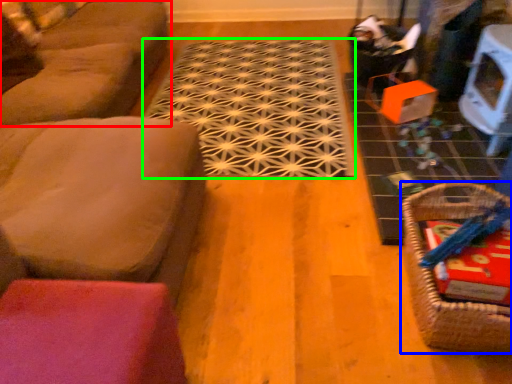
Question: Which object is positioned farthest from studio couch (highlighted by a red box)? Select from basket (highlighted by a blue box) and doormat (highlighted by a green box).

Choices:
 (A) basket
 (B) doormat

Answer: (A)